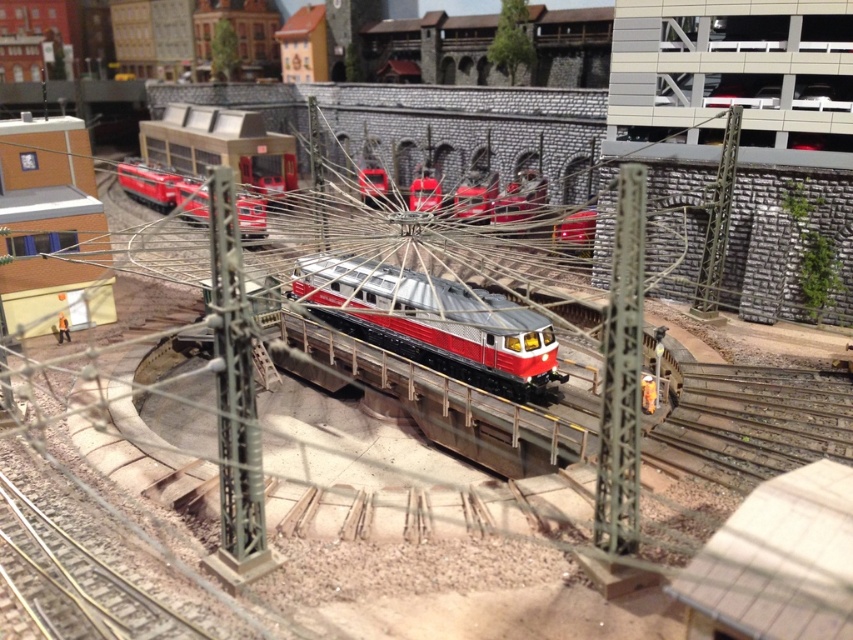
Is metallic silver train at center taller than red matte train at center?

No.

Can you confirm if metallic silver train at center is positioned above red matte train at center?

No.

Which is in front, point (335, 276) or point (194, 163)?

Point (335, 276) is more forward.

Where is `metallic silver train at center`? metallic silver train at center is located at coordinates (432, 323).

Does metallic silver train at center have a smaller size compared to red glossy train at center?

Actually, metallic silver train at center might be larger than red glossy train at center.

Who is more distant from viewer, (467, 368) or (376, 177)?

Positioned behind is point (376, 177).

Does point (500, 362) lie in front of point (360, 186)?

That is True.

You are a GUI agent. You are given a task and a screenshot of the screen. Output one action in this format:
    pyautogui.click(x=<x>, y=<y>)
    Task: Click on the metallic silver train at center
    The height and width of the screenshot is (640, 853).
    Given the screenshot: What is the action you would take?
    (432, 323)

Which of these two, metallic silver train at center or matte red train at upper left, stands shorter?

Standing shorter between the two is metallic silver train at center.

Is metallic silver train at center to the right of matte red train at upper left from the viewer's perspective?

Indeed, metallic silver train at center is positioned on the right side of matte red train at upper left.

Is point (525, 317) closer to viewer compared to point (206, 221)?

Yes, it is.

This screenshot has width=853, height=640. Find the location of `metallic silver train at center`. metallic silver train at center is located at coordinates 432,323.